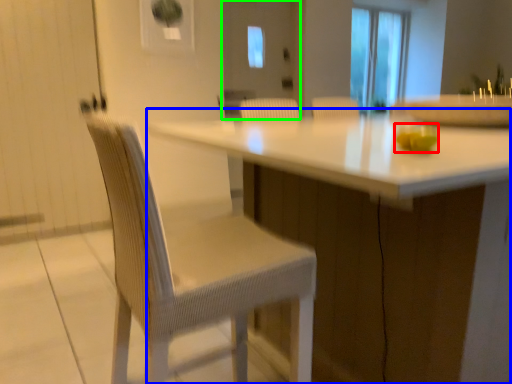
Question: Which object is the farthest from food (highlighted by a red box)? Choose among these: table (highlighted by a blue box) or screen door (highlighted by a green box).

Choices:
 (A) table
 (B) screen door

Answer: (B)